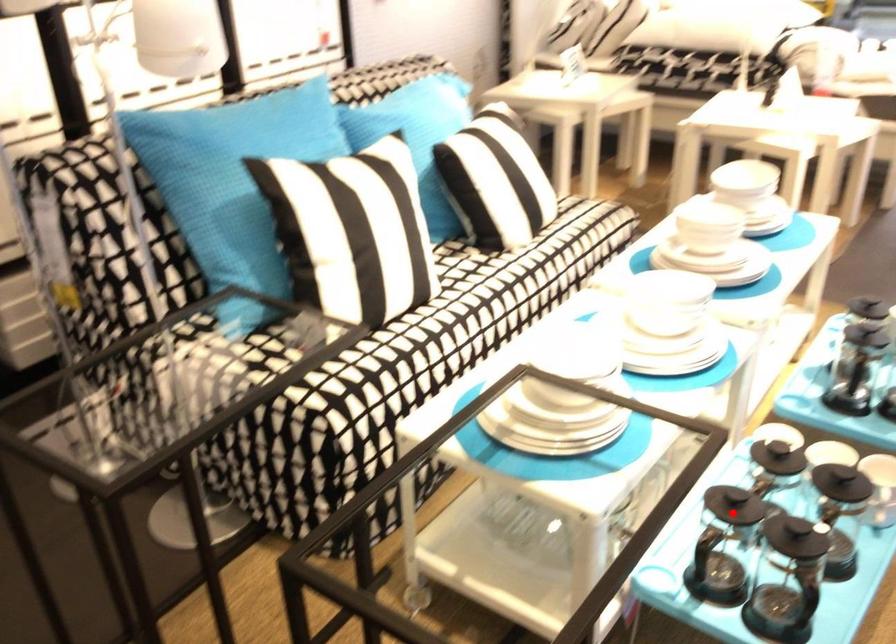
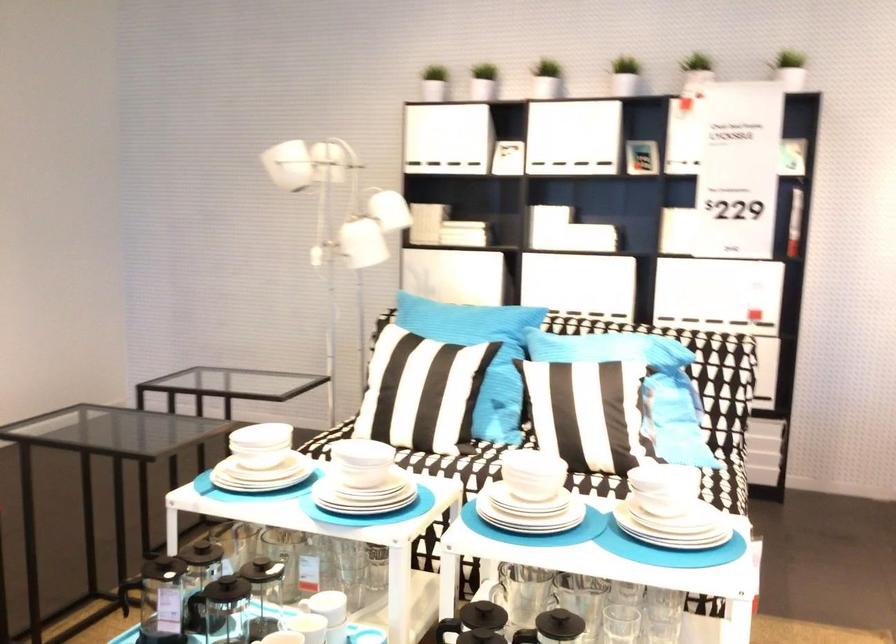
Question: A red point is marked in image1. In image2, is the corresponding 3D point closer to the camera or farther? Reply with the corresponding letter.

Choices:
 (A) The corresponding 3D point is closer.
 (B) The corresponding 3D point is farther.

Answer: (B)